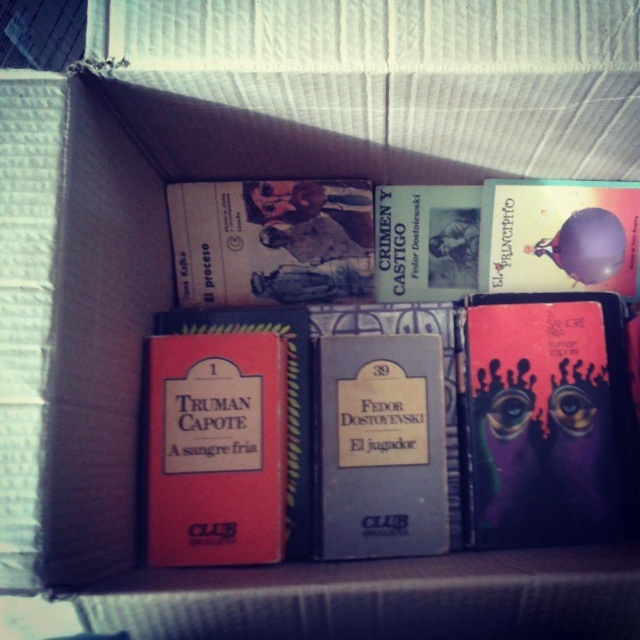
Is matte red book at center left further to the viewer compared to blue hardcover book at center?

No, matte red book at center left is closer to the viewer.

Is point (205, 483) farther from viewer compared to point (339, 360)?

That is False.

The width and height of the screenshot is (640, 640). Describe the element at coordinates (216, 449) in the screenshot. I see `matte red book at center left` at that location.

The width and height of the screenshot is (640, 640). In order to click on matte red book at center left in this screenshot , I will do `click(216, 449)`.

Can you confirm if blue hardcover book at center is smaller than hardcover book at upper center?

Actually, blue hardcover book at center might be larger than hardcover book at upper center.

Can you confirm if blue hardcover book at center is thinner than hardcover book at upper center?

Indeed, blue hardcover book at center has a lesser width compared to hardcover book at upper center.

You are a GUI agent. You are given a task and a screenshot of the screen. Output one action in this format:
    pyautogui.click(x=<x>, y=<y>)
    Task: Click on the blue hardcover book at center
    Image resolution: width=640 pixels, height=640 pixels.
    Given the screenshot: What is the action you would take?
    pyautogui.click(x=380, y=445)

Identify the location of blue hardcover book at center. (380, 445).

Is point (234, 182) behind point (442, 292)?

No, it is not.

Who is higher up, hardcover book at upper center or hardcover book at center?

Positioned higher is hardcover book at center.

Does point (264, 253) lie behind point (378, 272)?

No, (264, 253) is in front of (378, 272).

This screenshot has width=640, height=640. What are the coordinates of `hardcover book at upper center` in the screenshot? It's located at (272, 241).